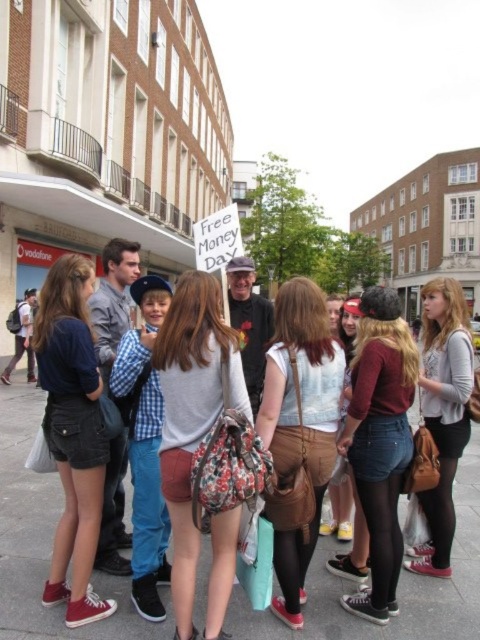
Question: Does concrete pavement at center appear under denim shorts at left?

Choices:
 (A) no
 (B) yes

Answer: (B)

Question: Considering the real-world distances, which object is closest to the denim shorts at left?

Choices:
 (A) checkered fabric shirt at center
 (B) concrete pavement at center

Answer: (A)

Question: Can you confirm if concrete pavement at center is bigger than floral fabric backpack at center?

Choices:
 (A) no
 (B) yes

Answer: (B)

Question: Which object is farther from the camera taking this photo?

Choices:
 (A) concrete pavement at center
 (B) checkered fabric shirt at center

Answer: (B)

Question: Does checkered fabric shirt at center have a smaller size compared to matte gray sweater at center?

Choices:
 (A) yes
 (B) no

Answer: (A)

Question: Which of the following is the farthest from the observer?

Choices:
 (A) (64, 282)
 (B) (331, 544)

Answer: (B)